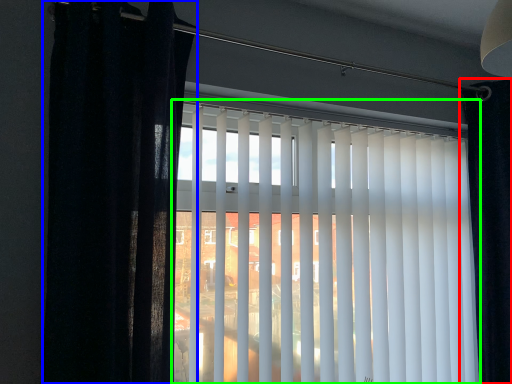
Question: Which is farther away from curtain (highlighted by a red box)? curtain (highlighted by a blue box) or window blind (highlighted by a green box)?

Choices:
 (A) curtain
 (B) window blind

Answer: (A)